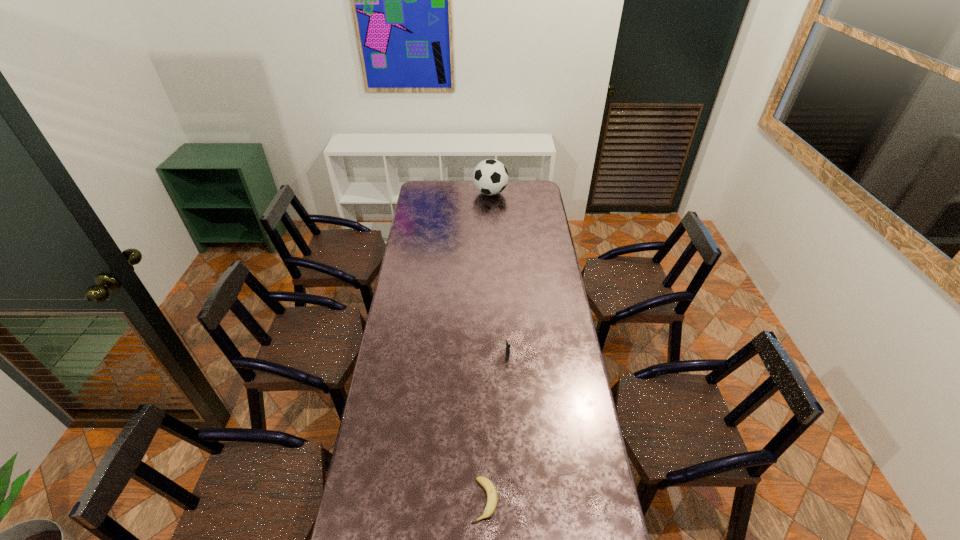
Where is `the farthest object`? The width and height of the screenshot is (960, 540). the farthest object is located at coordinates (490, 177).

Image resolution: width=960 pixels, height=540 pixels. I want to click on soccer ball, so click(x=490, y=177).

Locate an element on the screen. the second shortest object is located at coordinates (507, 339).

At what (x,y) coordinates should I click in order to perform the action: click on igniter. Please return your answer as a coordinate pair (x, y). Image resolution: width=960 pixels, height=540 pixels. Looking at the image, I should click on coord(507,339).

At what (x,y) coordinates should I click in order to perform the action: click on the shortest object. Please return your answer as a coordinate pair (x, y). Looking at the image, I should click on point(492,498).

You are a GUI agent. You are given a task and a screenshot of the screen. Output one action in this format:
    pyautogui.click(x=<x>, y=<y>)
    Task: Click on the banana
    
    Given the screenshot: What is the action you would take?
    [492, 498]

Identify the location of free space located on the right of the soccer ball. This screenshot has height=540, width=960. (521, 193).

Identify the location of blank space located 0.050m on the front of the second farthest object. This screenshot has height=540, width=960. (508, 368).

Locate an element on the screen. vacant region located on the right of the nearest object is located at coordinates (543, 501).

The height and width of the screenshot is (540, 960). I want to click on object that is at the far edge, so click(490, 177).